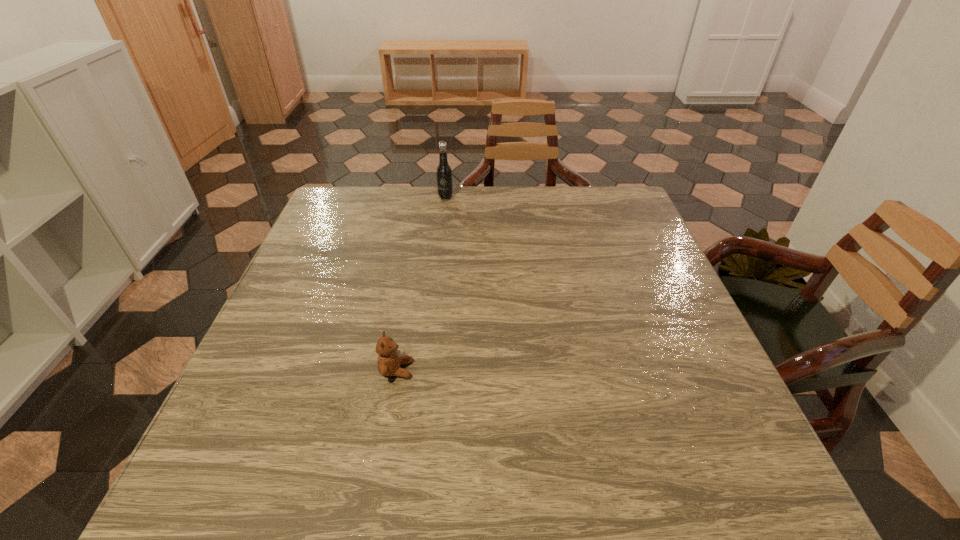
The width and height of the screenshot is (960, 540). Find the location of `free space at the far left corner`. free space at the far left corner is located at coordinates (339, 198).

Find the location of `free space at the far right corner`. free space at the far right corner is located at coordinates (589, 210).

Identify the location of blank area in the image that satisfies the following two spatial constraints: 1. on the label of the right object; 2. on the face of the nearer object. The image size is (960, 540). (426, 370).

At what (x,y) coordinates should I click in order to perform the action: click on free space that satisfies the following two spatial constraints: 1. on the label of the right object; 2. on the face of the nearer object. Please return your answer as a coordinate pair (x, y). The width and height of the screenshot is (960, 540). Looking at the image, I should click on (426, 370).

Where is `free space in the image that satisfies the following two spatial constraints: 1. on the label of the right object; 2. on the face of the teddy bear`? This screenshot has height=540, width=960. free space in the image that satisfies the following two spatial constraints: 1. on the label of the right object; 2. on the face of the teddy bear is located at coordinates click(x=426, y=370).

Locate an element on the screen. The width and height of the screenshot is (960, 540). vacant position in the image that satisfies the following two spatial constraints: 1. on the label of the root beer; 2. on the face of the shorter object is located at coordinates (426, 370).

Image resolution: width=960 pixels, height=540 pixels. What are the coordinates of `vacant area that satisfies the following two spatial constraints: 1. on the label of the taller object; 2. on the face of the shorter object` in the screenshot? It's located at (426, 370).

At what (x,y) coordinates should I click in order to perform the action: click on vacant point that satisfies the following two spatial constraints: 1. on the label of the right object; 2. on the face of the left object. Please return your answer as a coordinate pair (x, y). The height and width of the screenshot is (540, 960). Looking at the image, I should click on (426, 370).

This screenshot has height=540, width=960. In order to click on free spot that satisfies the following two spatial constraints: 1. on the label of the root beer; 2. on the face of the nearer object in this screenshot , I will do `click(426, 370)`.

This screenshot has height=540, width=960. I want to click on vacant space that satisfies the following two spatial constraints: 1. on the label of the farther object; 2. on the face of the left object, so click(426, 370).